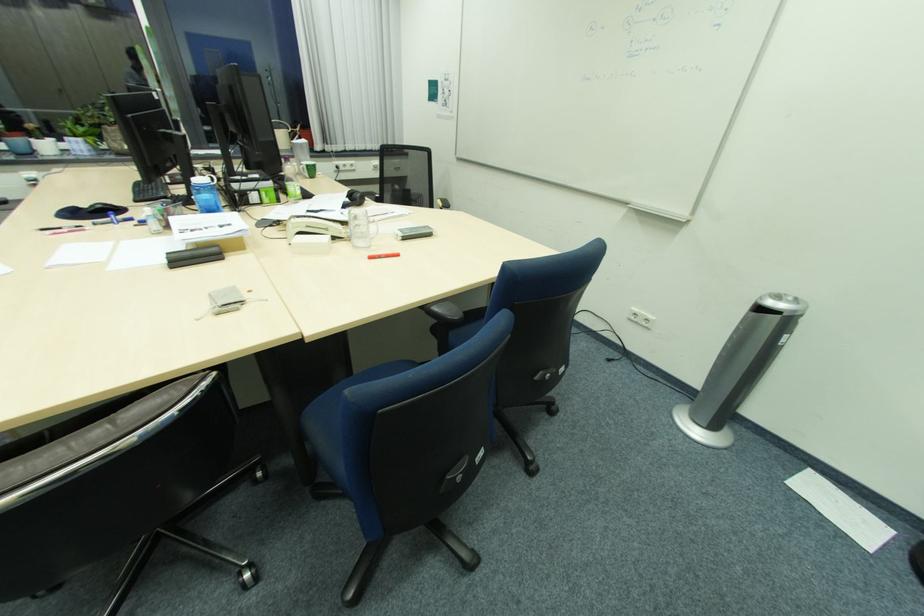
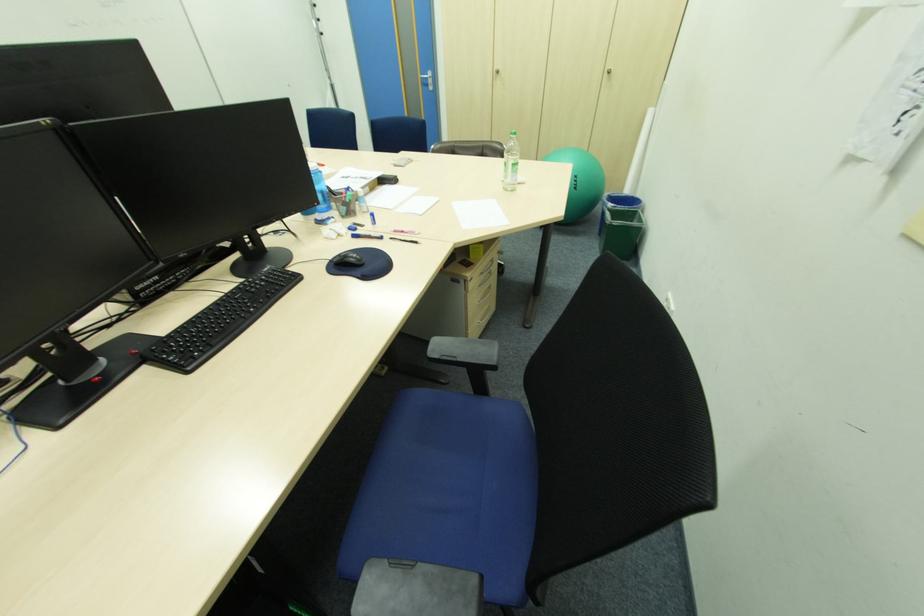
Question: I am providing you with two images of the same scene from different viewpoints. After the viewpoint changes to image2, which objects are now occluded?

Choices:
 (A) silver cabinet handle
 (B) blue chair sitting surface
 (C) black computer mouse
 (D) blue seat cushion

Answer: (B)